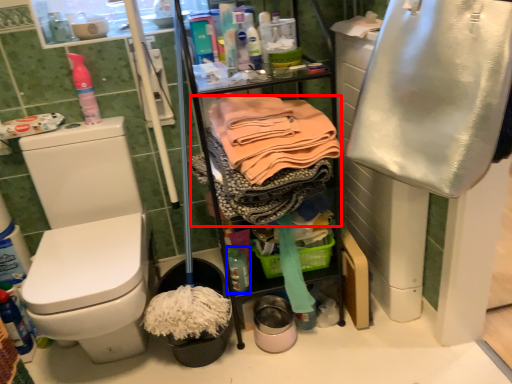
Question: Which object appears farthest to the camera in this image, clothing (highlighted by a red box) or bottle (highlighted by a blue box)?

Choices:
 (A) clothing
 (B) bottle

Answer: (B)